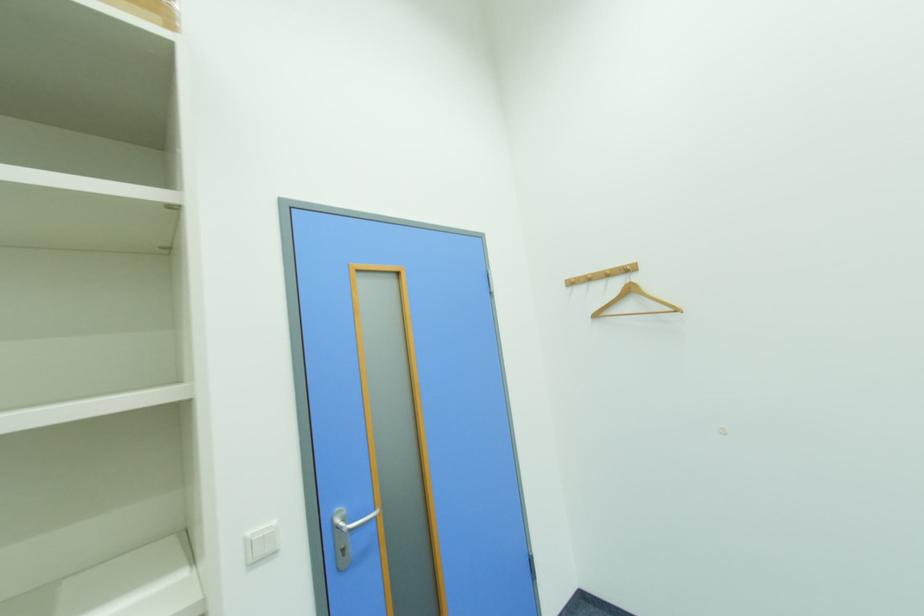
The height and width of the screenshot is (616, 924). I want to click on white light switch, so click(261, 543).